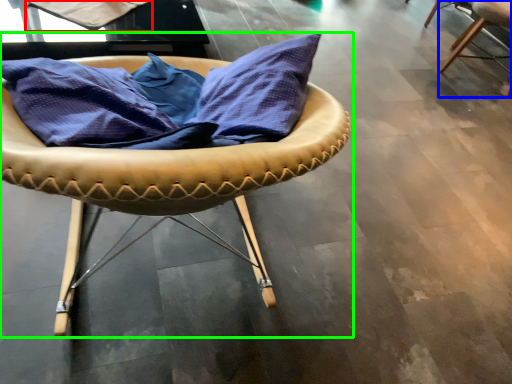
Question: Estimate the real-world distances between objects in this image. Which object is closer to fabric (highlighted by a red box), chair (highlighted by a blue box) or chair (highlighted by a green box)?

Choices:
 (A) chair
 (B) chair

Answer: (B)